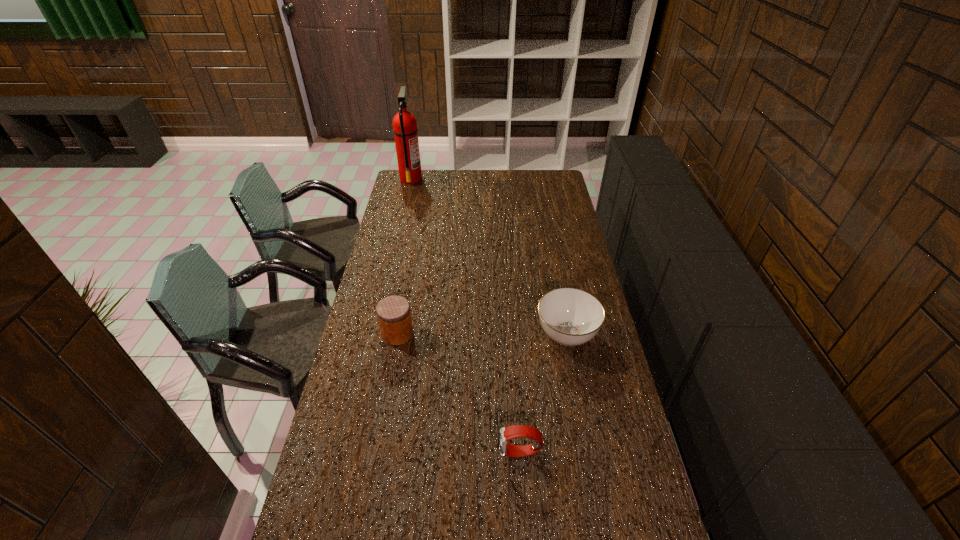
At what (x,y) coordinates should I click in order to perform the action: click on fire extinguisher. Please return your answer as a coordinate pair (x, y). Looking at the image, I should click on (405, 129).

You are a GUI agent. You are given a task and a screenshot of the screen. Output one action in this format:
    pyautogui.click(x=<x>, y=<y>)
    Task: Click on the farthest object
    
    Given the screenshot: What is the action you would take?
    pyautogui.click(x=405, y=129)

This screenshot has height=540, width=960. I want to click on jar, so click(x=394, y=316).

This screenshot has width=960, height=540. I want to click on chinaware, so click(x=569, y=316).

Identify the location of watch. The image size is (960, 540). (515, 431).

Identify the location of the second object from right to left. The image size is (960, 540). (515, 431).

At what (x,y) coordinates should I click in order to perform the action: click on free space located on the side of the fire extinguisher near the handle. Please return your answer as a coordinate pair (x, y). This screenshot has width=960, height=540. Looking at the image, I should click on (486, 178).

Identify the location of free space located on the right of the jar. (433, 333).

Where is `vacant space located 0.110m on the front of the chinaware`? vacant space located 0.110m on the front of the chinaware is located at coordinates (577, 387).

Locate an element on the screen. The image size is (960, 540). free spot located 0.160m on the face of the watch is located at coordinates (444, 453).